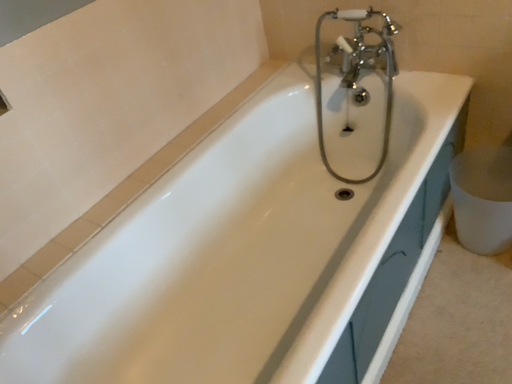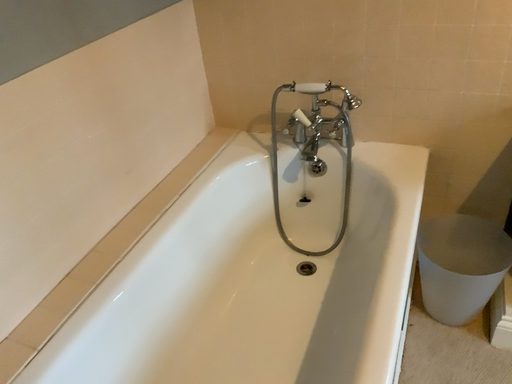
Question: Which way did the camera rotate in the video?

Choices:
 (A) rotated downward
 (B) rotated upward

Answer: (B)